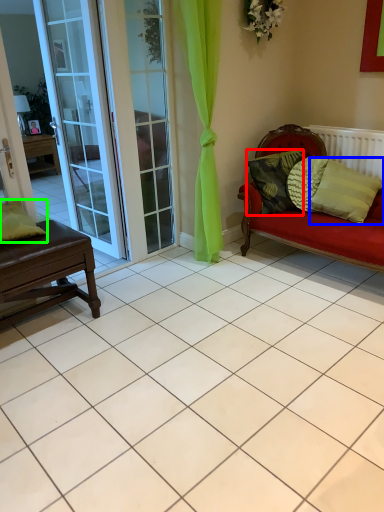
Question: Considering the real-world distances, which object is closest to pillow (highlighted by a red box)? pillow (highlighted by a blue box) or pillow (highlighted by a green box).

Choices:
 (A) pillow
 (B) pillow

Answer: (A)